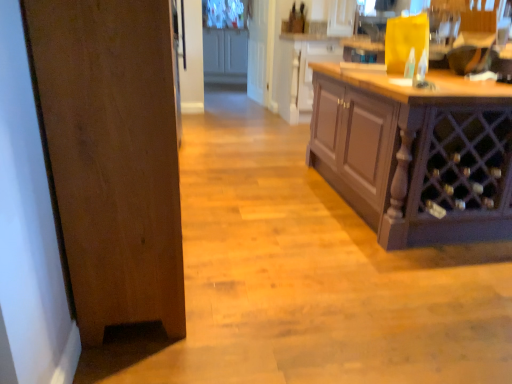
Question: Looking at the image, does brown wood cabinet at right, which ranks as the first cabinetry in bottom-to-top order, seem bigger or smaller compared to white glossy door at upper center?

Choices:
 (A) small
 (B) big

Answer: (B)

Question: Based on their positions, is brown wood cabinet at right, which ranks as the first cabinetry in front-to-back order, located to the left or right of white glossy door at upper center?

Choices:
 (A) left
 (B) right

Answer: (B)

Question: Considering the real-world distances, which object is closest to the matte gray cabinets at upper center, which is the 3th cabinetry from front to back?

Choices:
 (A) wooden door at left
 (B) matte wood cabinet at center, which is the 2th cabinetry from back to front
 (C) brown wood cabinet at right, which is the 3th cabinetry in top-to-bottom order
 (D) white glossy door at upper center

Answer: (D)

Question: Based on their relative distances, which object is nearer to the white glossy door at upper center?

Choices:
 (A) wooden door at left
 (B) matte wood cabinet at center, marked as the 2th cabinetry in a bottom-to-top arrangement
 (C) matte gray cabinets at upper center, which is the third cabinetry in bottom-to-top order
 (D) brown wood cabinet at right, which ranks as the first cabinetry in bottom-to-top order

Answer: (C)